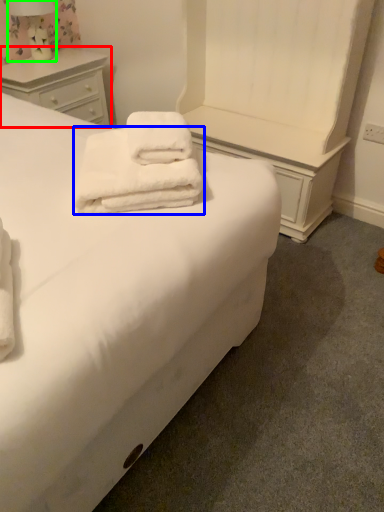
Question: Considering the real-world distances, which object is farthest from chest of drawers (highlighted by a red box)? towel (highlighted by a blue box) or bedside lamp (highlighted by a green box)?

Choices:
 (A) towel
 (B) bedside lamp

Answer: (A)